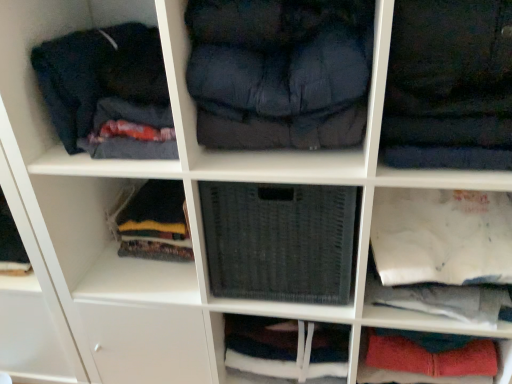
Where is `white paper bag at lower right, placed as the 3th cabinet when sorted from left to right`? This screenshot has width=512, height=384. white paper bag at lower right, placed as the 3th cabinet when sorted from left to right is located at coordinates (441, 251).

This screenshot has height=384, width=512. Identify the location of woven fabric basket at center, which ranks as the 3th cabinet in right-to-left order. (285, 348).

Measure the distance between point (470, 374) and camera.

A distance of 1.01 meters exists between point (470, 374) and camera.

What do you see at coordinates (280, 241) in the screenshot? I see `woven fabric basket at center, which is the first cabinet from left to right` at bounding box center [280, 241].

This screenshot has height=384, width=512. In order to click on dark blue fabric at center, the first clothing in the left-to-right sequence in this screenshot , I will do `click(280, 72)`.

Is red fabric pants at lower right, which is the first cabinet from right to left, thinner than white paper bag at lower right, the 2th cabinet from the right?

Yes, red fabric pants at lower right, which is the first cabinet from right to left, is thinner than white paper bag at lower right, the 2th cabinet from the right.

From their relative heights in the image, would you say red fabric pants at lower right, positioned as the fourth cabinet in left-to-right order, is taller or shorter than white paper bag at lower right, the 2th cabinet from the right?

In the image, red fabric pants at lower right, positioned as the fourth cabinet in left-to-right order, appears to be taller than white paper bag at lower right, the 2th cabinet from the right.

Image resolution: width=512 pixels, height=384 pixels. I want to click on the 1st cabinet to the left of the red fabric pants at lower right, positioned as the fourth cabinet in left-to-right order, counting from the anchor's position, so click(x=441, y=251).

Considering the positions of objects red fabric pants at lower right, which is the first cabinet from right to left, and dark blue fabric at upper left in the image provided, who is in front, red fabric pants at lower right, which is the first cabinet from right to left, or dark blue fabric at upper left?

dark blue fabric at upper left.

Which object is positioned more to the right, red fabric pants at lower right, positioned as the fourth cabinet in left-to-right order, or dark blue fabric at upper left?

Positioned to the right is red fabric pants at lower right, positioned as the fourth cabinet in left-to-right order.

From the image's perspective, who appears lower, red fabric pants at lower right, which is the first cabinet from right to left, or dark blue fabric at upper left?

red fabric pants at lower right, which is the first cabinet from right to left, is shown below in the image.

Which of these two, red fabric pants at lower right, which is the first cabinet from right to left, or dark blue fabric at upper left, is wider?

dark blue fabric at upper left is wider.

From the picture: Which object is closer to the camera taking this photo, dark blue fabric at upper right, the 1th clothing from the right, or woven fabric basket at center, which is the first cabinet from left to right?

dark blue fabric at upper right, the 1th clothing from the right.

Is dark blue fabric at upper right, the 1th clothing from the right, facing away from woven fabric basket at center, the 4th cabinet viewed from the right?

That's not correct — dark blue fabric at upper right, the 1th clothing from the right, is not looking away from woven fabric basket at center, the 4th cabinet viewed from the right.

Is woven fabric basket at center, the 4th cabinet viewed from the right, surrounded by dark blue fabric at upper right, placed as the 2th clothing when sorted from left to right?

No, woven fabric basket at center, the 4th cabinet viewed from the right, is not inside dark blue fabric at upper right, placed as the 2th clothing when sorted from left to right.

From a real-world perspective, is dark blue fabric at upper right, the 1th clothing from the right, positioned above or below woven fabric basket at center, the 4th cabinet viewed from the right?

From a real-world perspective, dark blue fabric at upper right, the 1th clothing from the right, is physically above woven fabric basket at center, the 4th cabinet viewed from the right.

Can you confirm if dark blue fabric at center, the first clothing in the left-to-right sequence, is bigger than woven fabric basket at center, which is the first cabinet from left to right?

Actually, dark blue fabric at center, the first clothing in the left-to-right sequence, might be smaller than woven fabric basket at center, which is the first cabinet from left to right.

Based on the photo, does dark blue fabric at center, the first clothing in the left-to-right sequence, have a greater width compared to woven fabric basket at center, the 4th cabinet viewed from the right?

Correct, the width of dark blue fabric at center, the first clothing in the left-to-right sequence, exceeds that of woven fabric basket at center, the 4th cabinet viewed from the right.

Could you measure the distance between dark blue fabric at center, marked as the second clothing in a right-to-left arrangement, and woven fabric basket at center, the 4th cabinet viewed from the right?

They are 9.06 inches apart.

Which of these two, red fabric pants at lower right, positioned as the fourth cabinet in left-to-right order, or woven fabric basket at center, which is the first cabinet from left to right, is wider?

Wider between the two is woven fabric basket at center, which is the first cabinet from left to right.

Does point (366, 346) lie in front of point (246, 235)?

No, it is not.

Measure the distance from red fabric pants at lower right, positioned as the fourth cabinet in left-to-right order, to woven fabric basket at center, the 4th cabinet viewed from the right.

red fabric pants at lower right, positioned as the fourth cabinet in left-to-right order, and woven fabric basket at center, the 4th cabinet viewed from the right, are 13.94 inches apart from each other.

Is red fabric pants at lower right, which is the first cabinet from right to left, touching woven fabric basket at center, the 4th cabinet viewed from the right?

No, red fabric pants at lower right, which is the first cabinet from right to left, is not touching woven fabric basket at center, the 4th cabinet viewed from the right.

Is red fabric pants at lower right, positioned as the fourth cabinet in left-to-right order, at the right side of woven fabric basket at center, which is the second cabinet from left to right?

Correct, you'll find red fabric pants at lower right, positioned as the fourth cabinet in left-to-right order, to the right of woven fabric basket at center, which is the second cabinet from left to right.

Considering the sizes of objects red fabric pants at lower right, positioned as the fourth cabinet in left-to-right order, and woven fabric basket at center, which ranks as the 3th cabinet in right-to-left order, in the image provided, who is taller, red fabric pants at lower right, positioned as the fourth cabinet in left-to-right order, or woven fabric basket at center, which ranks as the 3th cabinet in right-to-left order,?

Standing taller between the two is woven fabric basket at center, which ranks as the 3th cabinet in right-to-left order.

Considering the relative sizes of red fabric pants at lower right, which is the first cabinet from right to left, and woven fabric basket at center, which ranks as the 3th cabinet in right-to-left order, in the image provided, is red fabric pants at lower right, which is the first cabinet from right to left, thinner than woven fabric basket at center, which ranks as the 3th cabinet in right-to-left order,?

Indeed, red fabric pants at lower right, which is the first cabinet from right to left, has a lesser width compared to woven fabric basket at center, which ranks as the 3th cabinet in right-to-left order.

Is point (364, 365) closer to camera compared to point (226, 327)?

Yes, it is in front of point (226, 327).

Measure the distance from woven fabric basket at center, which is the first cabinet from left to right, to dark blue fabric at upper left.

They are 12.54 inches apart.

Considering the relative sizes of woven fabric basket at center, the 4th cabinet viewed from the right, and dark blue fabric at upper left in the image provided, is woven fabric basket at center, the 4th cabinet viewed from the right, thinner than dark blue fabric at upper left?

Correct, the width of woven fabric basket at center, the 4th cabinet viewed from the right, is less than that of dark blue fabric at upper left.

Is woven fabric basket at center, which is the first cabinet from left to right, oriented away from dark blue fabric at upper left?

A: No, woven fabric basket at center, which is the first cabinet from left to right, is not facing the opposite direction of dark blue fabric at upper left.

Is woven fabric basket at center, the 4th cabinet viewed from the right, smaller than dark blue fabric at upper left?

No.

You are a GUI agent. You are given a task and a screenshot of the screen. Output one action in this format:
    pyautogui.click(x=<x>, y=<y>)
    Task: Click on the 2nd cabinet behind when counting from the white paper bag at lower right, placed as the 3th cabinet when sorted from left to right
    
    Given the screenshot: What is the action you would take?
    pyautogui.click(x=408, y=371)

Identify the location of the 3rd cabinet below the dark blue fabric at upper left (from a real-world perspective). (408, 371).

Based on the photo, which object lies nearer to the anchor point dark blue fabric at upper left, woven fabric basket at center, which is the first cabinet from left to right, or white paper bag at lower right, the 2th cabinet from the right?

The object closer to dark blue fabric at upper left is woven fabric basket at center, which is the first cabinet from left to right.

Consider the image. From the image, which object appears to be farther from white paper bag at lower right, placed as the 3th cabinet when sorted from left to right, woven fabric basket at center, which is the second cabinet from left to right, or dark blue fabric at upper left?

dark blue fabric at upper left lies further to white paper bag at lower right, placed as the 3th cabinet when sorted from left to right, than the other object.

Which object lies further to the anchor point white paper bag at lower right, placed as the 3th cabinet when sorted from left to right, woven fabric basket at center, the 4th cabinet viewed from the right, or red fabric pants at lower right, positioned as the fourth cabinet in left-to-right order?

Based on the image, red fabric pants at lower right, positioned as the fourth cabinet in left-to-right order, appears to be further to white paper bag at lower right, placed as the 3th cabinet when sorted from left to right.

Looking at the image, which one is located closer to woven fabric basket at center, which is the second cabinet from left to right, dark blue fabric at upper right, placed as the 2th clothing when sorted from left to right, or dark blue fabric at center, the first clothing in the left-to-right sequence?

Based on the image, dark blue fabric at center, the first clothing in the left-to-right sequence, appears to be nearer to woven fabric basket at center, which is the second cabinet from left to right.

Based on their spatial positions, is white paper bag at lower right, placed as the 3th cabinet when sorted from left to right, or dark blue fabric at upper left closer to woven fabric basket at center, the 4th cabinet viewed from the right?

white paper bag at lower right, placed as the 3th cabinet when sorted from left to right, is positioned closer to the anchor woven fabric basket at center, the 4th cabinet viewed from the right.

From the image, which object appears to be nearer to woven fabric basket at center, the 4th cabinet viewed from the right, dark blue fabric at upper right, placed as the 2th clothing when sorted from left to right, or dark blue fabric at upper left?

dark blue fabric at upper right, placed as the 2th clothing when sorted from left to right.

When comparing their distances from white paper bag at lower right, the 2th cabinet from the right, does dark blue fabric at upper left or red fabric pants at lower right, positioned as the fourth cabinet in left-to-right order, seem further?

dark blue fabric at upper left lies further to white paper bag at lower right, the 2th cabinet from the right, than the other object.

From the image, which object appears to be farther from dark blue fabric at upper right, placed as the 2th clothing when sorted from left to right, woven fabric basket at center, which is the first cabinet from left to right, or woven fabric basket at center, which ranks as the 3th cabinet in right-to-left order?

Among the two, woven fabric basket at center, which ranks as the 3th cabinet in right-to-left order, is located further to dark blue fabric at upper right, placed as the 2th clothing when sorted from left to right.

The image size is (512, 384). Identify the location of clothing between woven fabric basket at center, the 4th cabinet viewed from the right, and white paper bag at lower right, the 2th cabinet from the right. (449, 86).

This screenshot has width=512, height=384. I want to click on clothing situated between dark blue fabric at upper left and dark blue fabric at upper right, the 1th clothing from the right, from left to right, so click(x=280, y=72).

Where is `clothing situated between dark blue fabric at center, marked as the second clothing in a right-to-left arrangement, and white paper bag at lower right, placed as the 3th cabinet when sorted from left to right, from left to right`? Image resolution: width=512 pixels, height=384 pixels. clothing situated between dark blue fabric at center, marked as the second clothing in a right-to-left arrangement, and white paper bag at lower right, placed as the 3th cabinet when sorted from left to right, from left to right is located at coordinates (449, 86).

Find the location of `clothing that lies between dark blue fabric at center, marked as the second clothing in a right-to-left arrangement, and woven fabric basket at center, which ranks as the 3th cabinet in right-to-left order, from top to bottom`. clothing that lies between dark blue fabric at center, marked as the second clothing in a right-to-left arrangement, and woven fabric basket at center, which ranks as the 3th cabinet in right-to-left order, from top to bottom is located at coordinates (449, 86).